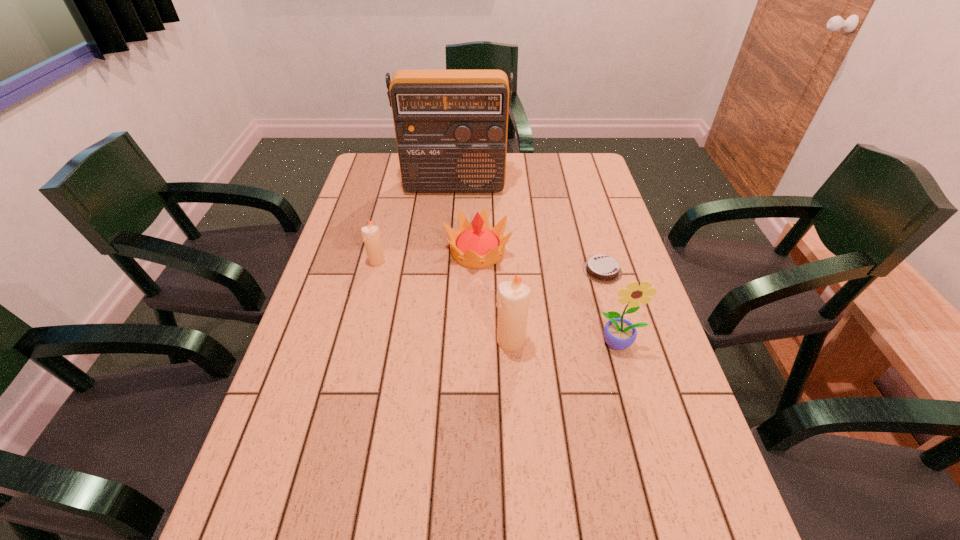
The height and width of the screenshot is (540, 960). What are the coordinates of `free point located on the left of the taller candle` in the screenshot? It's located at (405, 341).

The height and width of the screenshot is (540, 960). Find the location of `free space located 0.220m on the front-facing side of the radio receiver`. free space located 0.220m on the front-facing side of the radio receiver is located at coordinates (450, 237).

At what (x,y) coordinates should I click in order to perform the action: click on vacant space situated 0.360m on the front of the chocolate cake. Please return your answer as a coordinate pair (x, y). The image size is (960, 540). Looking at the image, I should click on (640, 400).

Where is `free space located 0.350m on the back of the crown`? The height and width of the screenshot is (540, 960). free space located 0.350m on the back of the crown is located at coordinates (478, 173).

Where is `vacant area situated on the front-facing side of the sunflower`? This screenshot has width=960, height=540. vacant area situated on the front-facing side of the sunflower is located at coordinates (628, 374).

Locate an element on the screen. object at the far edge is located at coordinates [x=451, y=126].

The width and height of the screenshot is (960, 540). Find the location of `candle present at the left edge`. candle present at the left edge is located at coordinates (371, 235).

You are a GUI agent. You are given a task and a screenshot of the screen. Output one action in this format:
    pyautogui.click(x=<x>, y=<y>)
    Task: Click on the radio receiver situated at the left edge
    
    Given the screenshot: What is the action you would take?
    pyautogui.click(x=451, y=126)

At what (x,y) coordinates should I click in order to perform the action: click on chocolate cake located at the right edge. Please return your answer as a coordinate pair (x, y). The image size is (960, 540). Looking at the image, I should click on (600, 268).

Identify the location of sunflower that is positioned at the right edge. (619, 333).